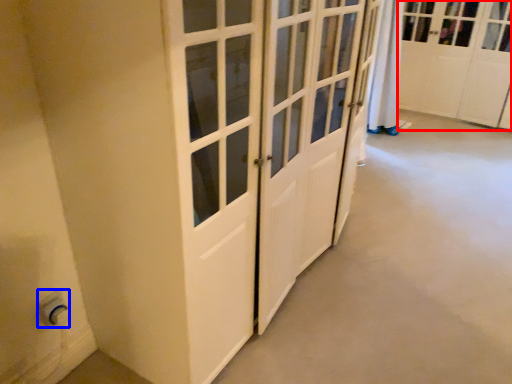
Question: Which of the following is the farthest to the observer, cabinetry (highlighted by a red box) or electric outlet (highlighted by a blue box)?

Choices:
 (A) cabinetry
 (B) electric outlet

Answer: (A)